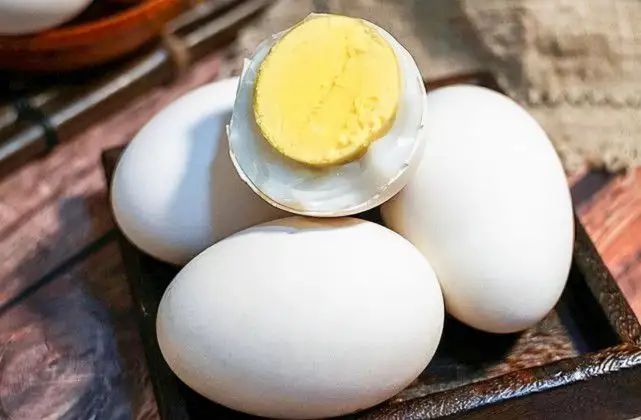
The height and width of the screenshot is (420, 641). In order to click on plate in this screenshot , I will do `click(620, 365)`.